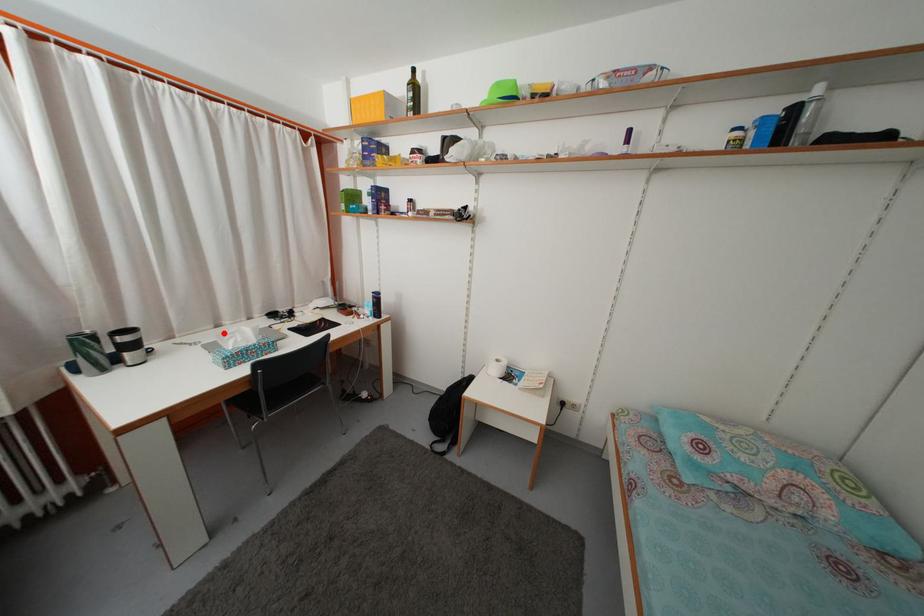
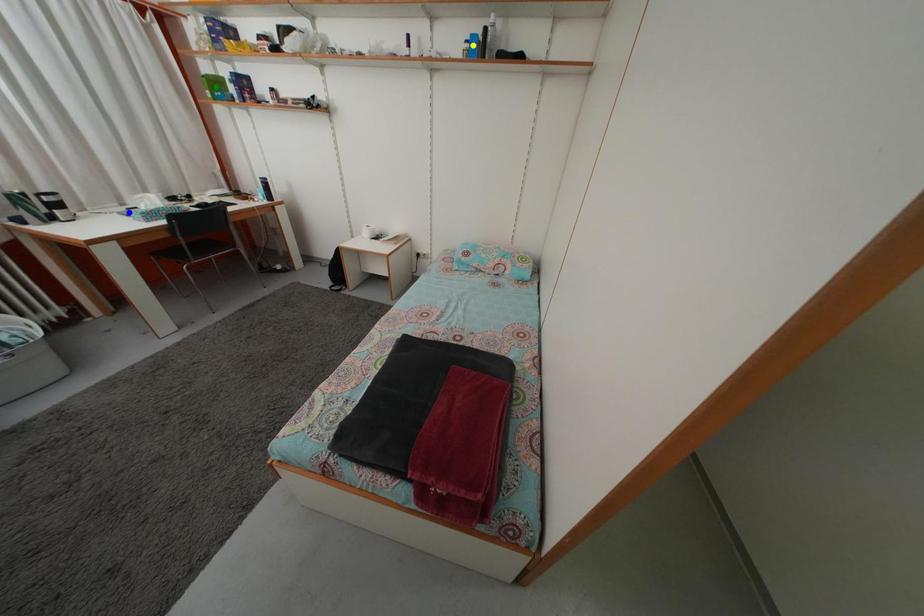
Question: I am providing you with two images of the same scene from different viewpoints. A red point is marked on the first image. You are given multiple points on the second image. Which point in image 2 is actually the same real-world point as the red point in image 1?

Choices:
 (A) yellow point
 (B) blue point
 (C) green point

Answer: (B)